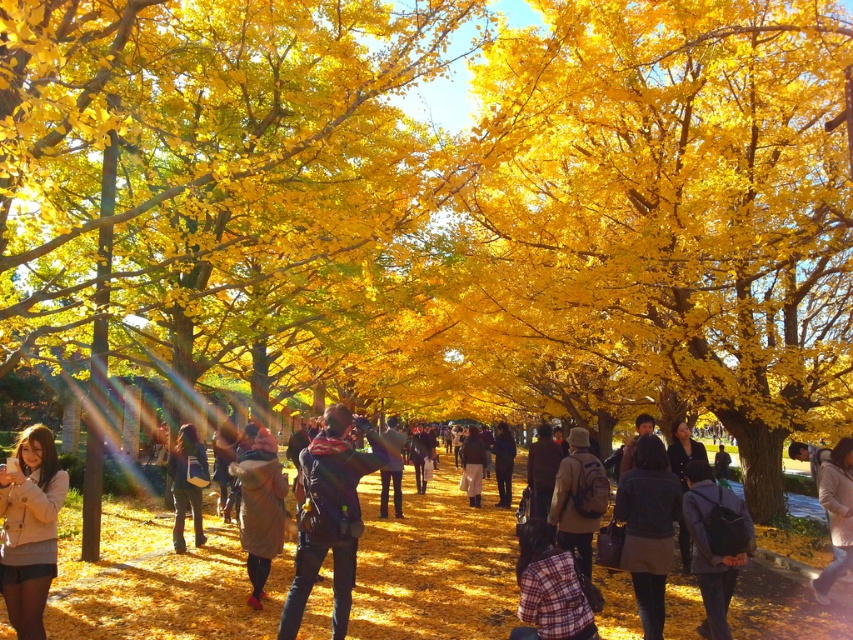
Between golden leafy tree at center and velvet brown coat at center, which one has more height?

Standing taller between the two is golden leafy tree at center.

Is point (712, 60) behind point (254, 520)?

Yes, point (712, 60) is behind point (254, 520).

Image resolution: width=853 pixels, height=640 pixels. What do you see at coordinates (677, 202) in the screenshot?
I see `golden leafy tree at center` at bounding box center [677, 202].

Identify the location of golden leafy tree at center. (677, 202).

Which is below, golden leafy tree at center or matte beige coat at lower left?

matte beige coat at lower left

Can you confirm if golden leafy tree at center is smaller than matte beige coat at lower left?

No.

What do you see at coordinates (677, 202) in the screenshot?
I see `golden leafy tree at center` at bounding box center [677, 202].

What are the coordinates of `golden leafy tree at center` in the screenshot? It's located at (677, 202).

Between point (328, 499) and point (186, 436), which one is positioned behind?

Positioned behind is point (186, 436).

Which is in front, point (310, 525) or point (175, 509)?

Point (310, 525) is more forward.

You are a GUI agent. You are given a task and a screenshot of the screen. Output one action in this format:
    pyautogui.click(x=<x>, y=<y>)
    Task: Click on the dark blue jeans at center
    The height and width of the screenshot is (640, 853).
    Given the screenshot: What is the action you would take?
    pyautogui.click(x=329, y=515)